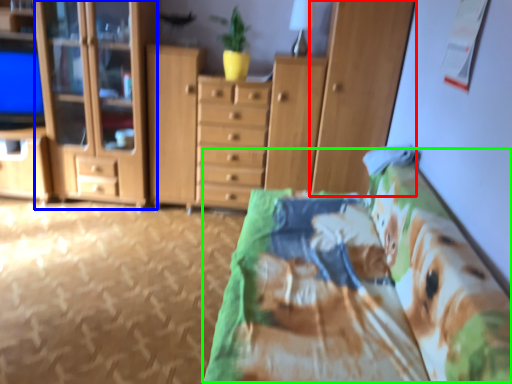
Question: Considering the real-world distances, which object is farthest from cabinetry (highlighted by a red box)? cabinetry (highlighted by a blue box) or bed (highlighted by a green box)?

Choices:
 (A) cabinetry
 (B) bed

Answer: (A)